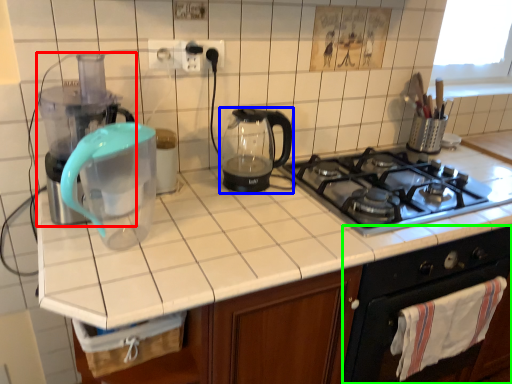
Question: Which is farther away from blender (highlighted by a red box)? kitchen appliance (highlighted by a blue box) or oven (highlighted by a green box)?

Choices:
 (A) kitchen appliance
 (B) oven

Answer: (B)